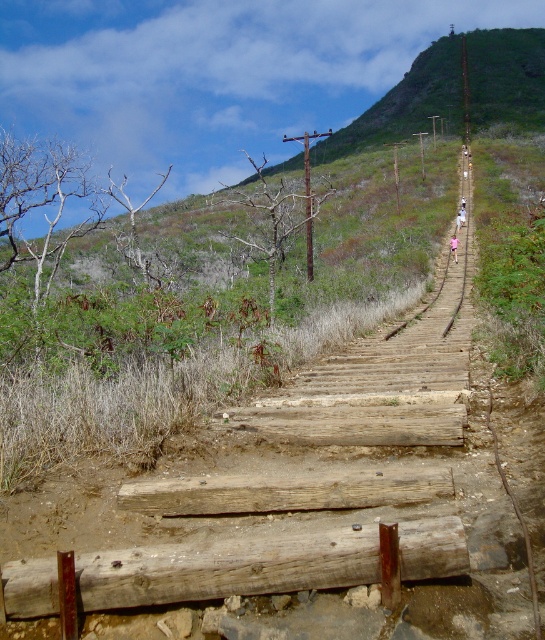
Question: Is weathered wood at center bigger than weathered brown log at center?

Choices:
 (A) yes
 (B) no

Answer: (A)

Question: Does weathered wood at center appear over weathered brown log at center?

Choices:
 (A) yes
 (B) no

Answer: (B)

Question: Where is weathered wood at center located in relation to weathered brown log at center in the image?

Choices:
 (A) below
 (B) above

Answer: (A)

Question: Which point is farther from the camera taking this photo?

Choices:
 (A) (396, 470)
 (B) (185, 600)

Answer: (A)

Question: Which of the following is the farthest from the observer?

Choices:
 (A) weathered wood at center
 (B) weathered brown log at center

Answer: (B)